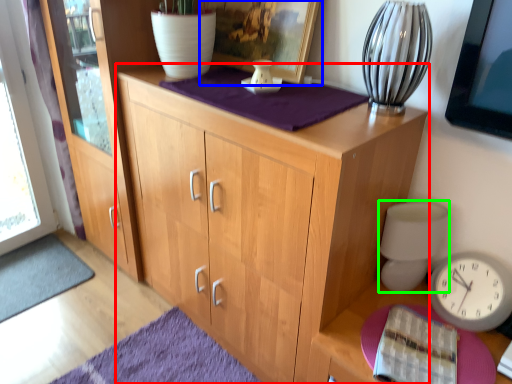
Question: Estimate the real-world distances between objects in this image. Which object is farther from cabinetry (highlighted by a red box), picture frame (highlighted by a blue box) or table lamp (highlighted by a green box)?

Choices:
 (A) picture frame
 (B) table lamp

Answer: (A)